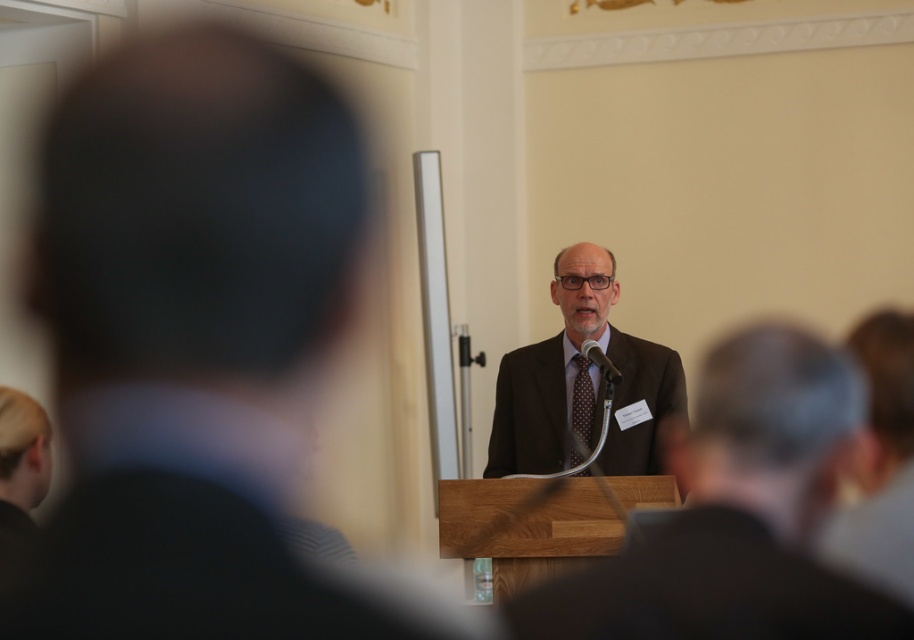
Is brown suit at center bigger than dark brown fabric business suit at center?

Indeed, brown suit at center has a larger size compared to dark brown fabric business suit at center.

Does brown suit at center have a lesser height compared to dark brown fabric business suit at center?

Incorrect, brown suit at center's height does not fall short of dark brown fabric business suit at center's.

Is point (98, 532) positioned behind point (679, 627)?

No, it is not.

You are a GUI agent. You are given a task and a screenshot of the screen. Output one action in this format:
    pyautogui.click(x=<x>, y=<y>)
    Task: Click on the brown suit at center
    Image resolution: width=914 pixels, height=640 pixels.
    Given the screenshot: What is the action you would take?
    pyautogui.click(x=197, y=346)

This screenshot has height=640, width=914. What do you see at coordinates (737, 515) in the screenshot?
I see `matte brown suit at center` at bounding box center [737, 515].

Can you confirm if matte brown suit at center is positioned to the left of brown dotted fabric tie at center?

Yes, matte brown suit at center is to the left of brown dotted fabric tie at center.

Is point (579, 573) more distant than point (578, 474)?

No, it is not.

The height and width of the screenshot is (640, 914). I want to click on matte brown suit at center, so pos(737,515).

Is dark brown fabric business suit at center wider than brown dotted fabric tie at center?

Yes.

Is dark brown fabric business suit at center taller than brown dotted fabric tie at center?

Incorrect, dark brown fabric business suit at center's height is not larger of brown dotted fabric tie at center's.

Which is in front, point (558, 605) or point (572, 384)?

Point (558, 605) is more forward.

The height and width of the screenshot is (640, 914). In order to click on dark brown fabric business suit at center in this screenshot , I will do `click(705, 589)`.